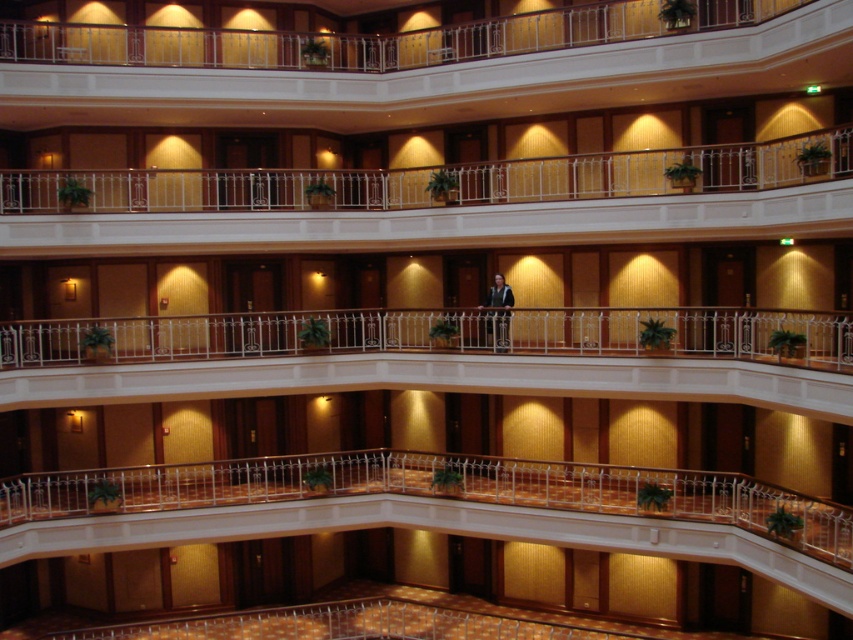
Measure the distance between white glossy railing at center and white metal railing at upper center.

2.78 meters

Can you confirm if white glossy railing at center is positioned below white metal railing at upper center?

Indeed, white glossy railing at center is positioned under white metal railing at upper center.

This screenshot has height=640, width=853. What do you see at coordinates (437, 355) in the screenshot? I see `white glossy railing at center` at bounding box center [437, 355].

Find the location of a particular element. This screenshot has width=853, height=640. white glossy railing at center is located at coordinates (437, 355).